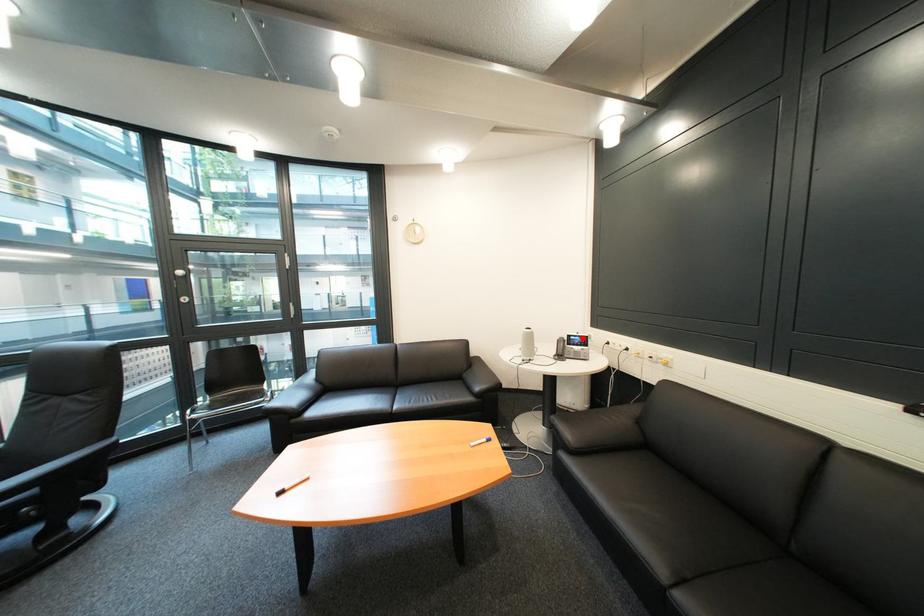
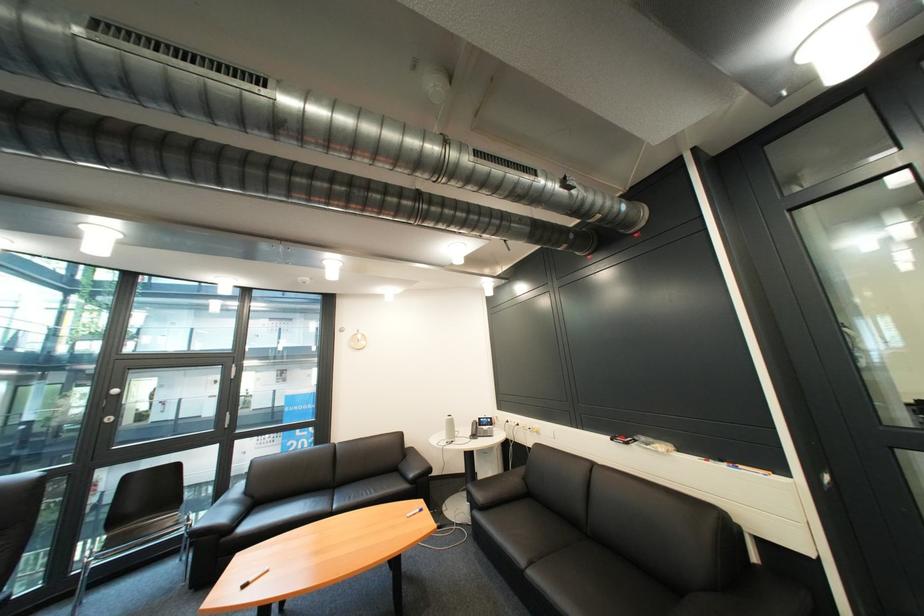
Question: I am providing you with two images of the same scene from different viewpoints. A red point is marked on the first image. At the location where the point appears in image 1, is it still visible in image 2?

Choices:
 (A) Yes
 (B) No

Answer: (A)